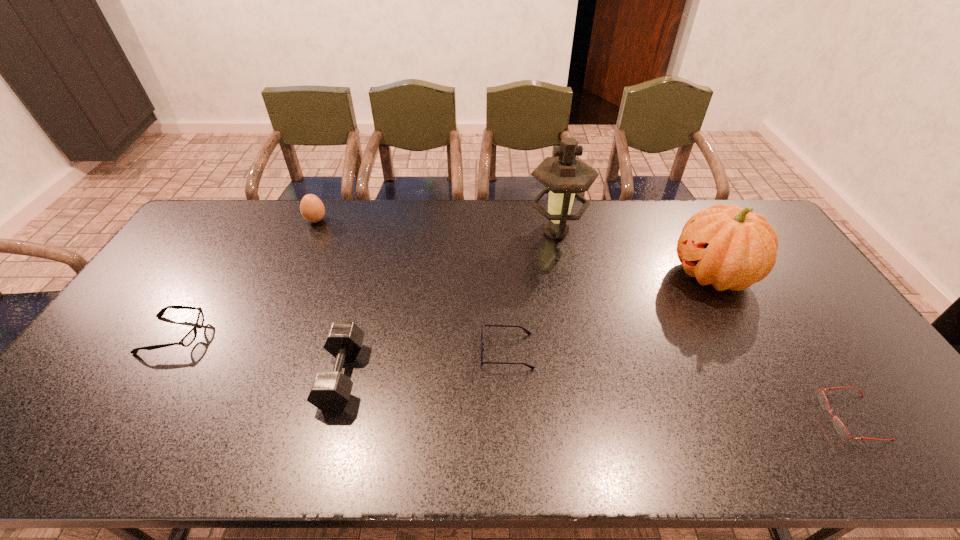
The width and height of the screenshot is (960, 540). In order to click on free space between the third object from right to left and the boiled egg in this screenshot , I will do `click(436, 226)`.

I want to click on free space between the second spectacles from left to right and the second tallest object, so click(x=610, y=313).

Identify which object is located as the second nearest to the rightmost spectacles. Please provide its 2D coordinates. Your answer should be formatted as a tuple, i.e. [(x, y)], where the tuple contains the x and y coordinates of a point satisfying the conditions above.

[(529, 333)]

At what (x,y) coordinates should I click in order to perform the action: click on object that stands as the closest to the rightmost spectacles. Please return your answer as a coordinate pair (x, y). The height and width of the screenshot is (540, 960). Looking at the image, I should click on (731, 248).

Where is `spectacles that stands as the closest to the leftmost object`? spectacles that stands as the closest to the leftmost object is located at coordinates (529, 333).

Choose which spectacles is the second nearest neighbor to the second spectacles from left to right. Please provide its 2D coordinates. Your answer should be formatted as a tuple, i.e. [(x, y)], where the tuple contains the x and y coordinates of a point satisfying the conditions above.

[(188, 339)]

The height and width of the screenshot is (540, 960). Find the location of `free space that satisfies the following two spatial constraints: 1. on the front side of the fifth object from left to right; 2. on the front-facing side of the second spectacles from left to right`. free space that satisfies the following two spatial constraints: 1. on the front side of the fifth object from left to right; 2. on the front-facing side of the second spectacles from left to right is located at coordinates (581, 352).

Find the location of `free space that satisfies the following two spatial constraints: 1. on the front-facing side of the leftmost object; 2. on the back side of the dumbbell`. free space that satisfies the following two spatial constraints: 1. on the front-facing side of the leftmost object; 2. on the back side of the dumbbell is located at coordinates (148, 375).